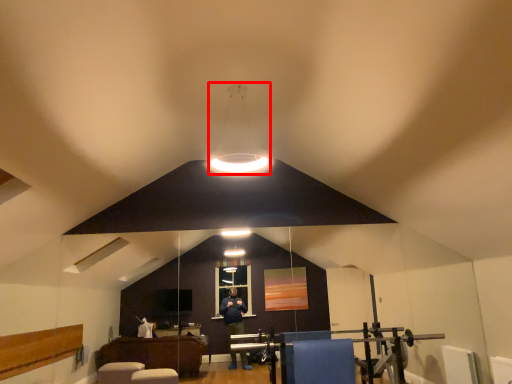
Question: In this image, where is lamp (annotated by the red box) located relative to furniture?

Choices:
 (A) right
 (B) left

Answer: (B)